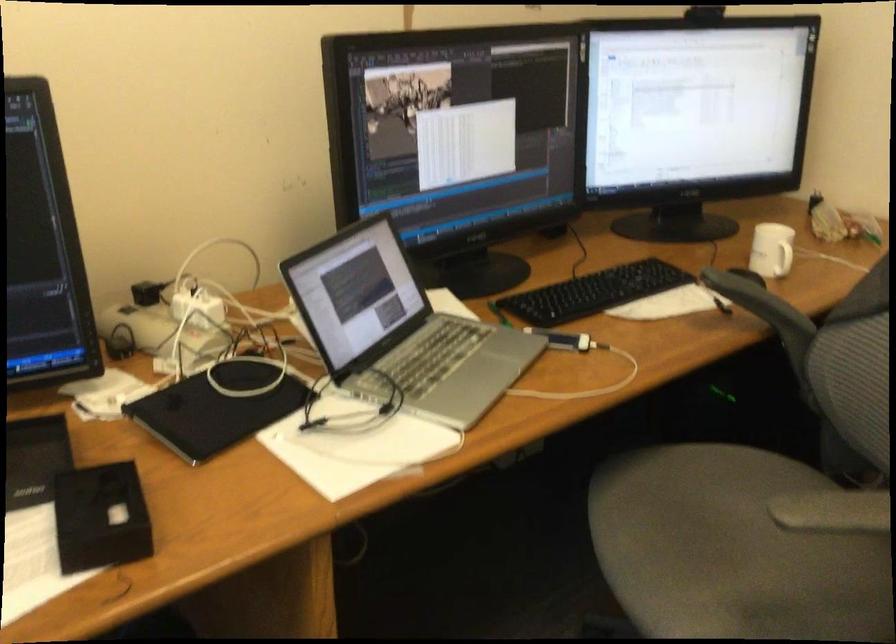
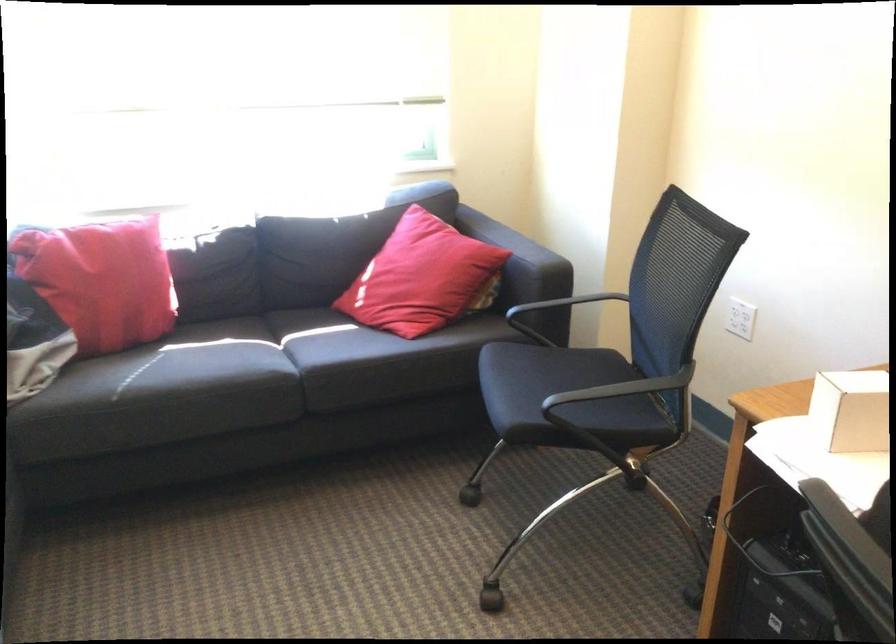
First-person continuous shooting, in which direction is the camera rotating?

The camera rotated toward left-down.